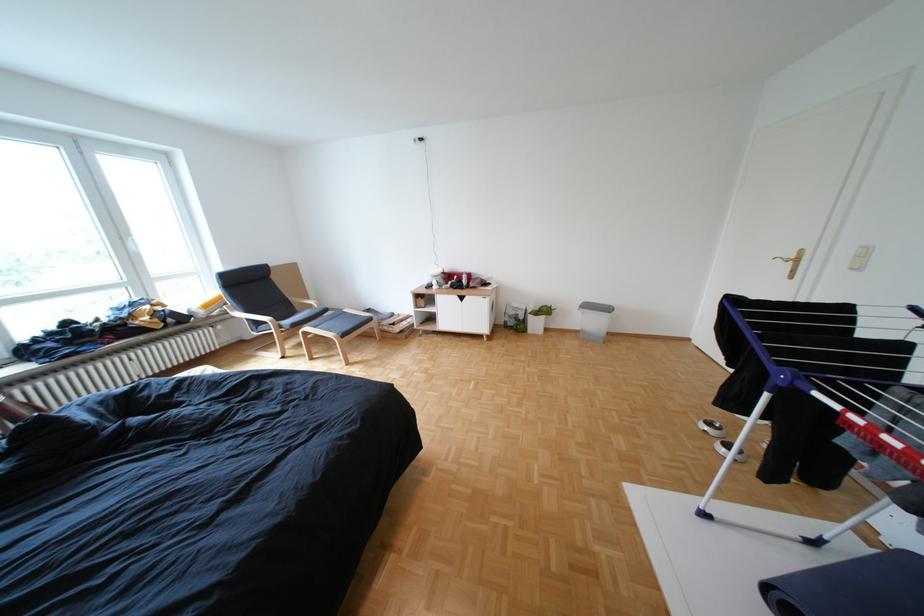
The image size is (924, 616). What do you see at coordinates (299, 317) in the screenshot?
I see `a chair sitting surface` at bounding box center [299, 317].